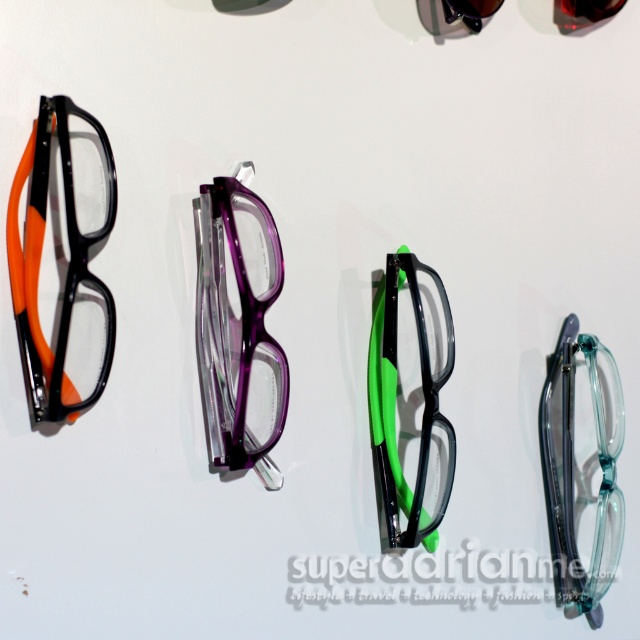
Question: Which point is farther to the camera?

Choices:
 (A) (435, 512)
 (B) (561, 554)
 (C) (253, 292)
 (D) (26, 157)

Answer: (B)

Question: Is purple translucent glasses at center wider than black matte/glossy glasses at center?

Choices:
 (A) yes
 (B) no

Answer: (A)

Question: Which point is closer to the camera taking this photo?

Choices:
 (A) (237, 301)
 (B) (566, 422)

Answer: (A)

Question: Which point is closer to the camera?

Choices:
 (A) (589, 563)
 (B) (241, 305)
 (C) (438, 499)

Answer: (B)

Question: Can you confirm if purple translucent glasses at center is thinner than transparent plastic glasses at right?

Choices:
 (A) no
 (B) yes

Answer: (A)

Question: Does matte black glasses at left have a larger size compared to purple translucent glasses at center?

Choices:
 (A) no
 (B) yes

Answer: (B)